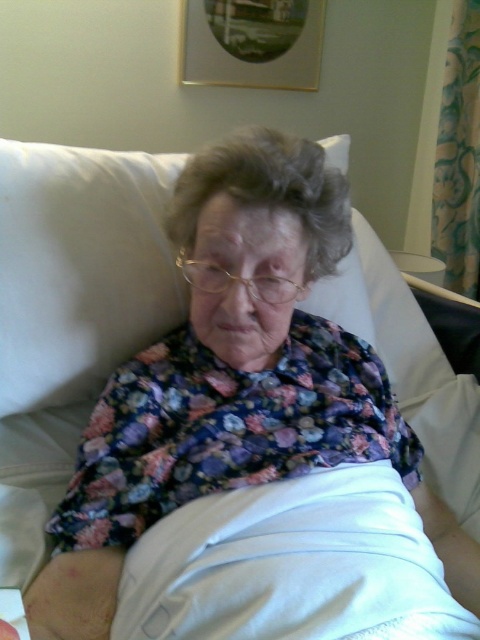
Question: Among these objects, which one is farthest from the camera?

Choices:
 (A) white fabric at center
 (B) white fabric pillow at upper center

Answer: (B)

Question: Where is white fabric at center located in relation to white fabric pillow at upper center in the image?

Choices:
 (A) above
 (B) below

Answer: (B)

Question: Is white fabric at center positioned at the back of white fabric pillow at upper center?

Choices:
 (A) no
 (B) yes

Answer: (A)

Question: Which point is farther from the camera taking this photo?

Choices:
 (A) (177, 596)
 (B) (87, 202)

Answer: (B)

Question: Does white fabric at center appear on the left side of white fabric pillow at upper center?

Choices:
 (A) no
 (B) yes

Answer: (A)